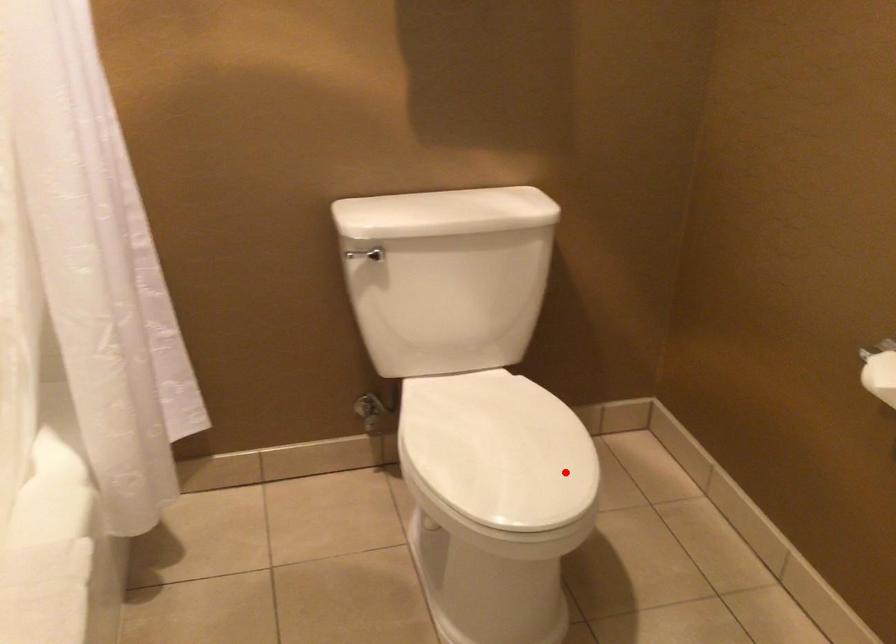
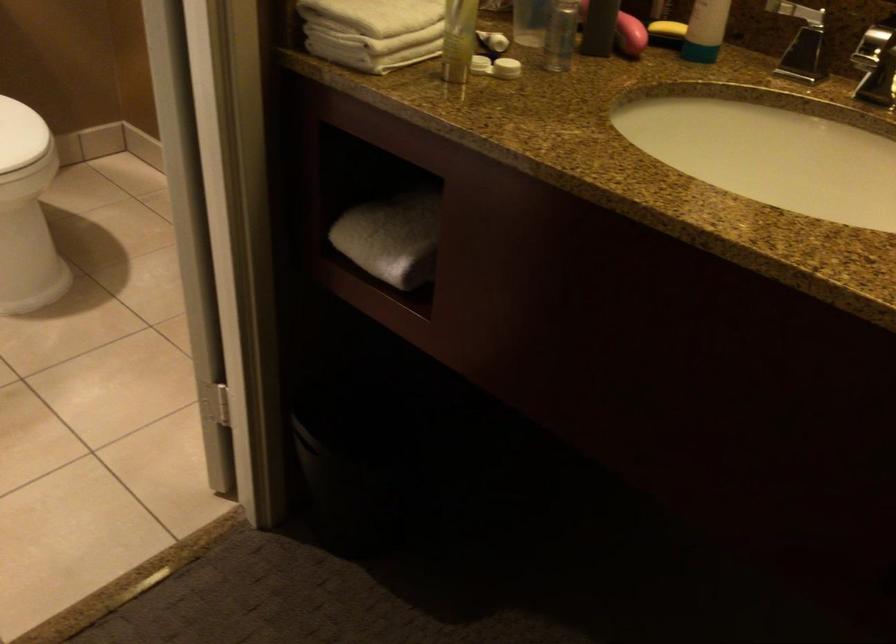
In the second image, find the point that corresponds to the highlighted location in the first image.

(20, 135)